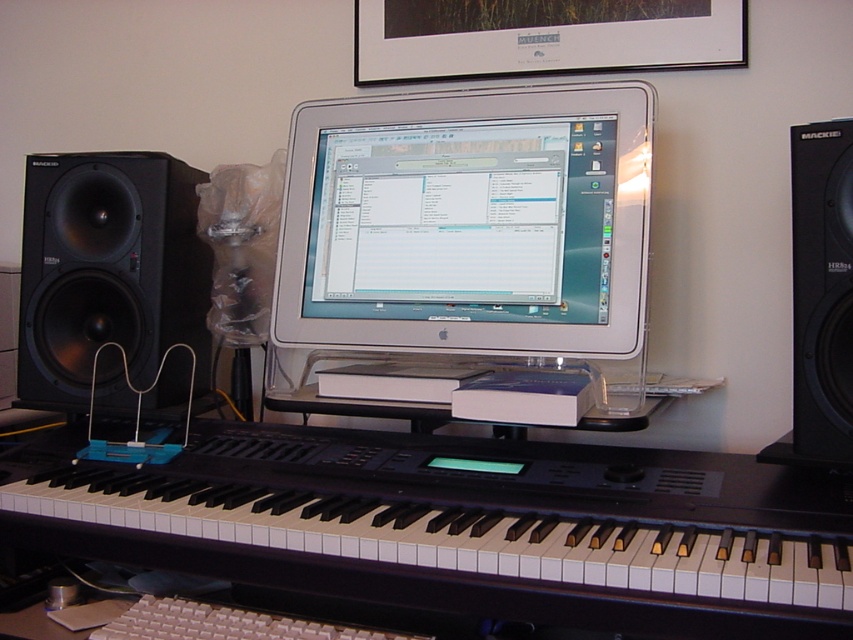
You are setting up a home studio and need to place a microphone stand. The microphone stand must be positioned to the right of the black matte speaker at left. According to the image, where should you place the microphone stand?

The microphone stand should be placed to the right of the black matte speaker at left, which is located at point (108, 269). Since the speaker is on the left, placing the stand to its right would be the correct position.

You are setting up a music production studio and need to place a 12 cm tall amplifier on your desk. You have space between the white glossy desktop computer at center and the black matte speaker at left. Can the amplifier fit vertically between them without exceeding the height of either?

The white glossy desktop computer at center is taller than the black matte speaker at left. Since the amplifier is only 12 cm tall, it can fit vertically between them as long as its height doesn not exceed the shorter object, which is the black matte speaker at left. However, the exact height of the speaker isn known, so this depends on whether the speaker is taller than 12 cm.

You are setting up a home studio and want to place the black matte speaker at left and the white plastic keyboard at center on a desk. The desk has a width of 20 inches. Will both items fit side by side on the desk without overlapping?

The distance between the black matte speaker at left and white plastic keyboard at center is 21.02 inches, which is slightly longer than the desk width of 20 inches. Therefore, they cannot fit side by side without overlapping.